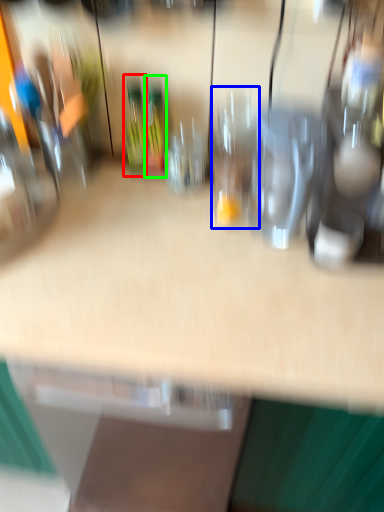
Question: Based on their relative distances, which object is nearer to bottle (highlighted by a red box)? Choose from wine glass (highlighted by a blue box) and wine bottle (highlighted by a green box).

Choices:
 (A) wine glass
 (B) wine bottle

Answer: (B)